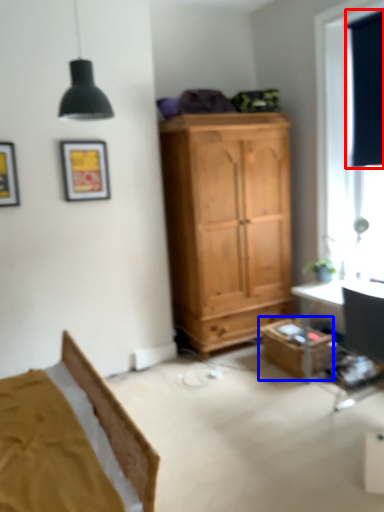
Question: Among these objects, which one is farthest to the camera, curtain (highlighted by a red box) or cabinetry (highlighted by a blue box)?

Choices:
 (A) curtain
 (B) cabinetry

Answer: (B)